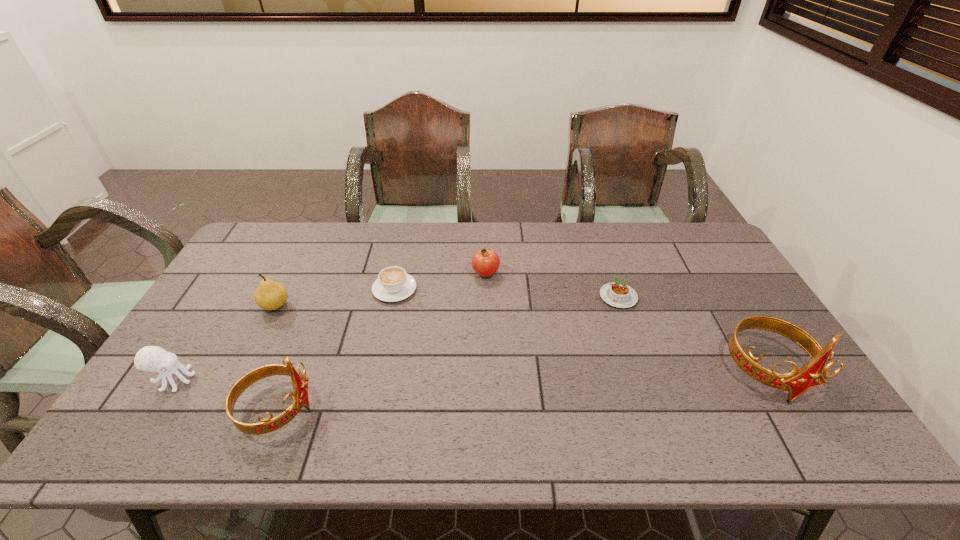
Please point a spot to place another tiara for symmetrical spacing. Please provide its 2D coordinates. Your answer should be formatted as a tuple, i.e. [(x, y)], where the tuple contains the x and y coordinates of a point satisfying the conditions above.

[(533, 389)]